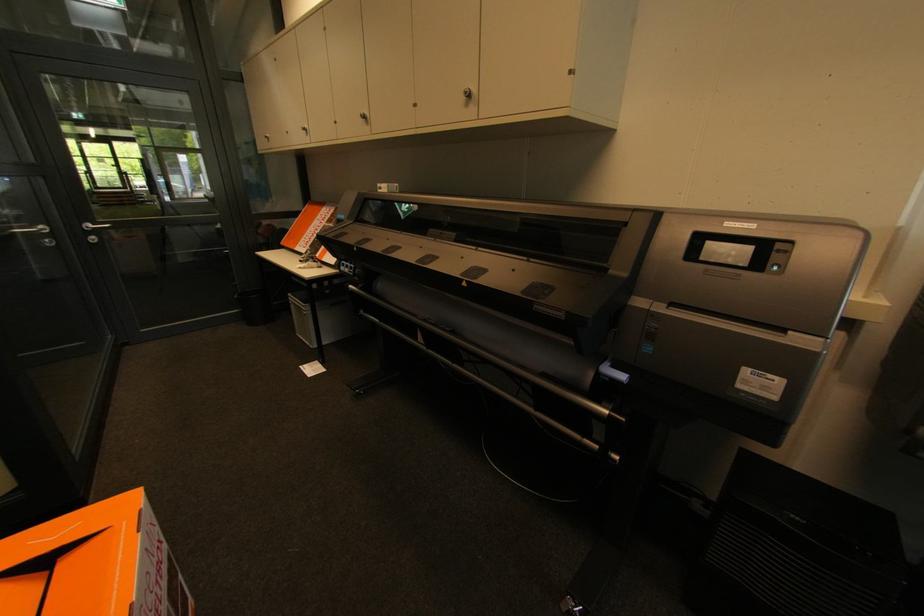
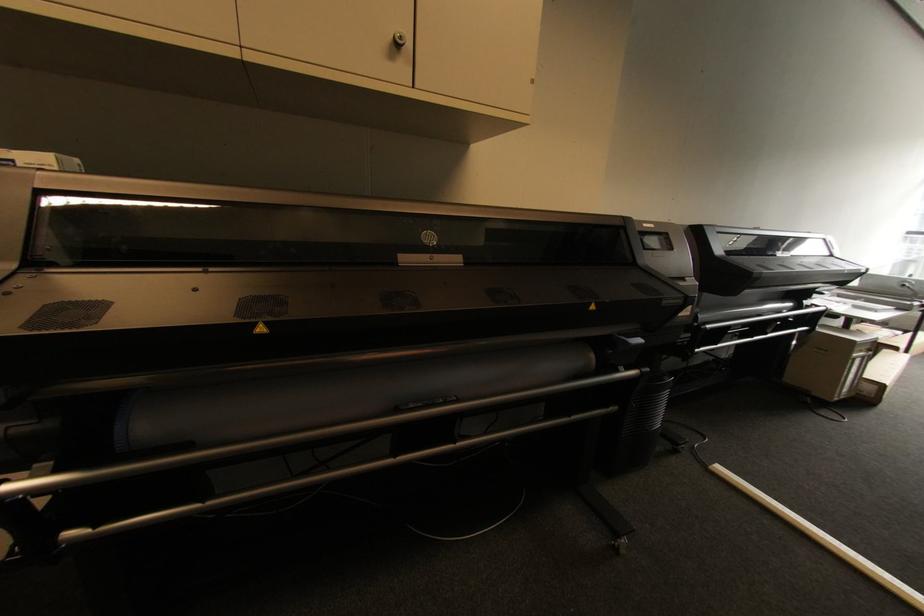
Where in the second image is the point corresponding to pixel 469 92 from the first image?

(405, 38)